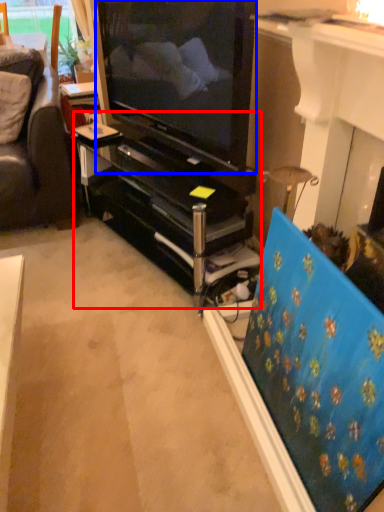
Question: Which object appears closest to the camera in this image, tv cabinet (highlighted by a red box) or television (highlighted by a blue box)?

Choices:
 (A) tv cabinet
 (B) television

Answer: (B)